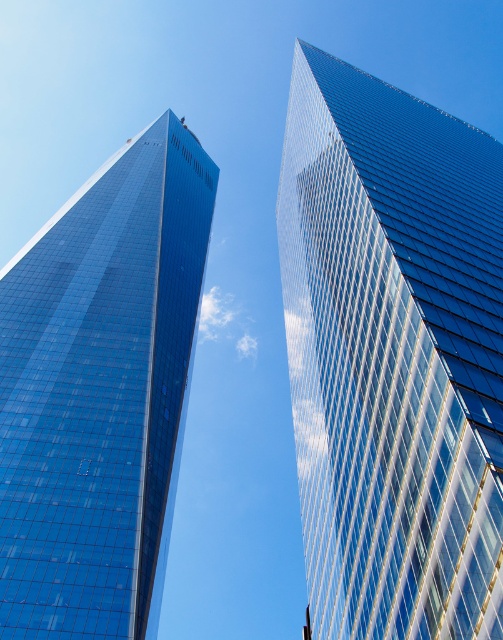
Does transparent glass skyscraper at upper center appear under shiny glass skyscraper at left?

Yes.

Is transparent glass skyscraper at upper center above shiny glass skyscraper at left?

Incorrect, transparent glass skyscraper at upper center is not positioned above shiny glass skyscraper at left.

This screenshot has width=503, height=640. Describe the element at coordinates (392, 356) in the screenshot. I see `transparent glass skyscraper at upper center` at that location.

Identify the location of transparent glass skyscraper at upper center. (392, 356).